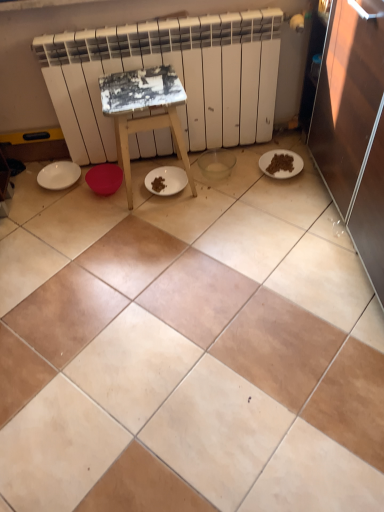
I want to click on vacant space that is to the left of white painted wood stool at center, so click(x=89, y=209).